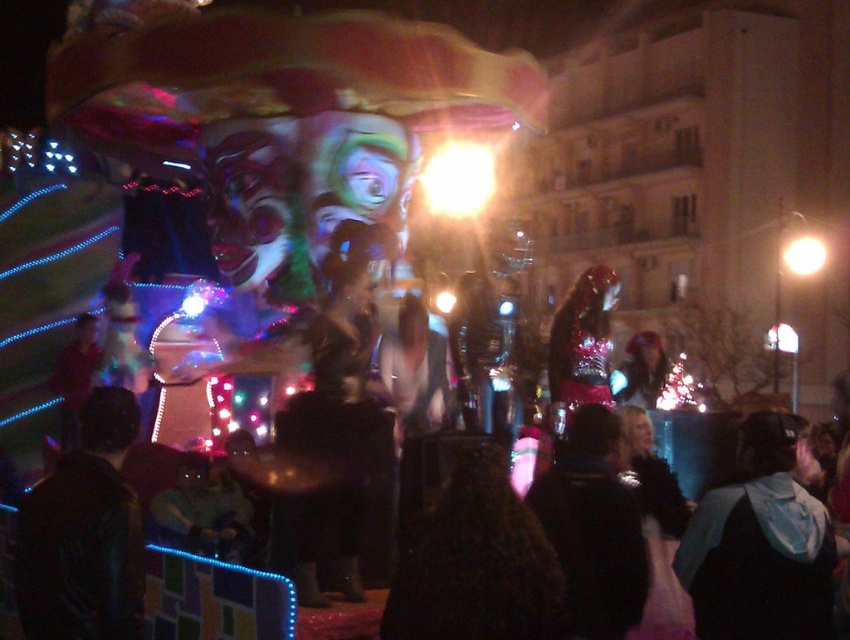
Question: Does shiny metallic helmet at center come in front of bright white bulb at upper right?

Choices:
 (A) yes
 (B) no

Answer: (A)

Question: Which point appears farthest from the camera in this image?

Choices:
 (A) (564, 426)
 (B) (647, 362)
 (C) (610, 561)
 (D) (792, 259)

Answer: (D)

Question: Is leather jacket at lower left to the right of shiny metallic helmet at center from the viewer's perspective?

Choices:
 (A) no
 (B) yes

Answer: (A)

Question: Considering the real-world distances, which object is farthest from the black fabric jacket at lower right?

Choices:
 (A) leather jacket at lower left
 (B) shiny metallic figure at center
 (C) black leather jacket at lower right

Answer: (A)

Question: Where is shiny metallic helmet at center located in relation to bright white bulb at upper right in the image?

Choices:
 (A) above
 (B) below

Answer: (B)

Question: Which is farther from the shiny metallic figure at center?

Choices:
 (A) leather jacket at lower left
 (B) black fabric jacket at lower right
 (C) bright white bulb at upper right
 (D) shiny metallic helmet at center

Answer: (C)